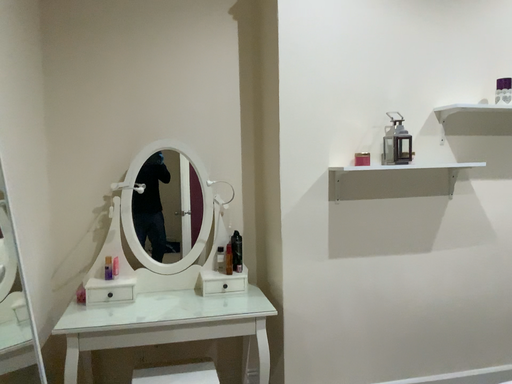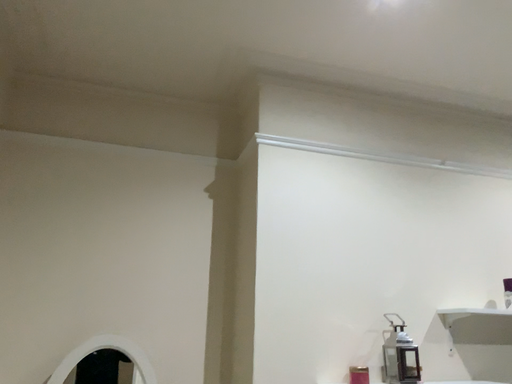
Question: Which way did the camera rotate in the video?

Choices:
 (A) rotated upward
 (B) rotated downward

Answer: (A)